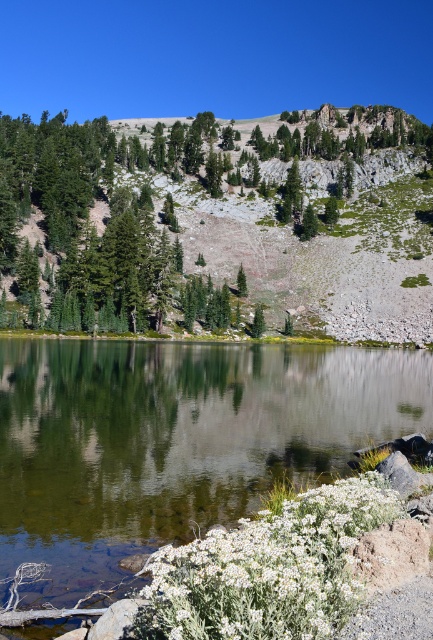
Question: Which of the following is the farthest from the observer?

Choices:
 (A) (246, 292)
 (B) (34, 518)
 (C) (61, 237)

Answer: (A)

Question: Is green reflective water at center smaller than green matte tree at center?

Choices:
 (A) yes
 (B) no

Answer: (B)

Question: Is green reflective water at center closer to camera compared to green leafy trees at upper left?

Choices:
 (A) yes
 (B) no

Answer: (A)

Question: Which point is farther from the camera taking this photo?

Choices:
 (A) (364, 180)
 (B) (241, 285)
 (C) (180, 384)

Answer: (A)

Question: Which object is closer to the camera taking this photo?

Choices:
 (A) green reflective water at center
 (B) green matte tree at center

Answer: (A)

Question: Can you confirm if green reflective water at center is smaller than green leafy trees at upper left?

Choices:
 (A) no
 (B) yes

Answer: (B)